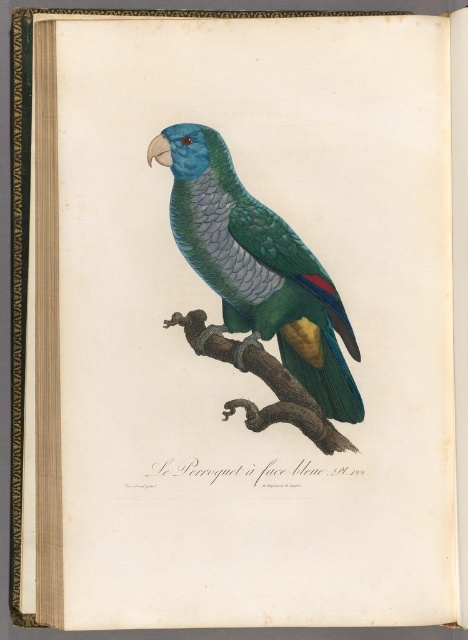
Between shiny green parrot at center and brown rough tree branch at center, which one appears on the right side from the viewer's perspective?

brown rough tree branch at center is more to the right.

Can you confirm if shiny green parrot at center is positioned below brown rough tree branch at center?

Incorrect, shiny green parrot at center is not positioned below brown rough tree branch at center.

Does point (195, 253) come in front of point (182, 317)?

Yes, point (195, 253) is in front of point (182, 317).

Where is `shiny green parrot at center`? This screenshot has height=640, width=468. shiny green parrot at center is located at coordinates (256, 268).